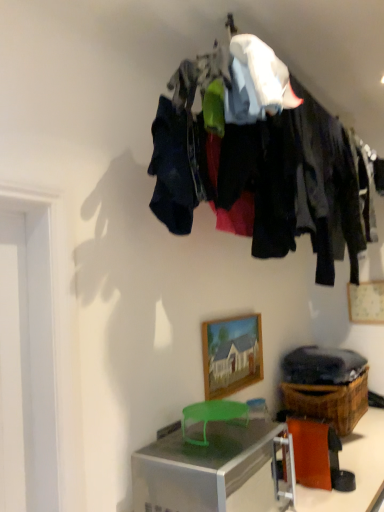
Question: Considering the relative sizes of brown woven basket at lower right and orange paper at lower right in the image provided, is brown woven basket at lower right wider than orange paper at lower right?

Choices:
 (A) no
 (B) yes

Answer: (B)

Question: Is the position of brown woven basket at lower right less distant than that of orange paper at lower right?

Choices:
 (A) no
 (B) yes

Answer: (A)

Question: Is brown woven basket at lower right next to orange paper at lower right and touching it?

Choices:
 (A) yes
 (B) no

Answer: (B)

Question: From a real-world perspective, is brown woven basket at lower right positioned over orange paper at lower right based on gravity?

Choices:
 (A) no
 (B) yes

Answer: (B)

Question: Considering the relative positions of brown woven basket at lower right and orange paper at lower right in the image provided, is brown woven basket at lower right to the right of orange paper at lower right from the viewer's perspective?

Choices:
 (A) yes
 (B) no

Answer: (A)

Question: Is brown woven basket at lower right further to the viewer compared to orange paper at lower right?

Choices:
 (A) yes
 (B) no

Answer: (A)

Question: Is dark fabric clothes at upper center wider than wooden picture frame at upper right, which is counted as the first picture frame, starting from the back?

Choices:
 (A) no
 (B) yes

Answer: (B)

Question: Considering the relative sizes of dark fabric clothes at upper center and wooden picture frame at upper right, the second picture frame viewed from the front, in the image provided, is dark fabric clothes at upper center bigger than wooden picture frame at upper right, the second picture frame viewed from the front,?

Choices:
 (A) no
 (B) yes

Answer: (B)

Question: Can you confirm if dark fabric clothes at upper center is thinner than wooden picture frame at upper right, marked as the first picture frame in a right-to-left arrangement?

Choices:
 (A) yes
 (B) no

Answer: (B)

Question: Is dark fabric clothes at upper center looking in the opposite direction of wooden picture frame at upper right, which is counted as the first picture frame, starting from the back?

Choices:
 (A) yes
 (B) no

Answer: (B)

Question: Does dark fabric clothes at upper center come behind wooden picture frame at upper right, which appears as the 2th picture frame when viewed from the left?

Choices:
 (A) yes
 (B) no

Answer: (B)

Question: Is dark fabric clothes at upper center at the right side of wooden picture frame at upper right, the second picture frame viewed from the front?

Choices:
 (A) no
 (B) yes

Answer: (A)

Question: Is orange paper at lower right smaller than wooden picture frame at center, the 2th picture frame when ordered from back to front?

Choices:
 (A) no
 (B) yes

Answer: (A)